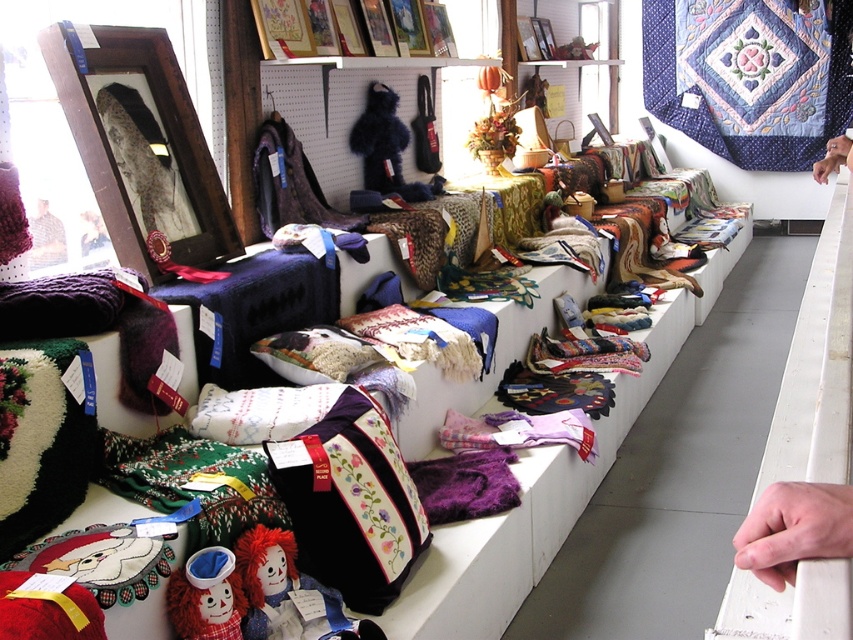
Question: Can you confirm if smooth skin hand at lower right is bigger than velvet cushion at center?

Choices:
 (A) yes
 (B) no

Answer: (B)

Question: Which point is farther from the camera taking this photo?

Choices:
 (A) (833, 500)
 (B) (38, 218)

Answer: (B)

Question: Based on their relative distances, which object is farther from the smooth skin hand at lower right?

Choices:
 (A) smooth skin hand at upper right
 (B) fuzzy fur coat at left

Answer: (B)

Question: Which point appears closest to the camera in this image?

Choices:
 (A) (x=827, y=172)
 (B) (x=39, y=205)

Answer: (B)

Question: Does velvet cushion at center lie behind smooth skin hand at upper right?

Choices:
 (A) yes
 (B) no

Answer: (A)

Question: Does smooth skin hand at lower right have a greater width compared to fuzzy fur coat at left?

Choices:
 (A) no
 (B) yes

Answer: (A)